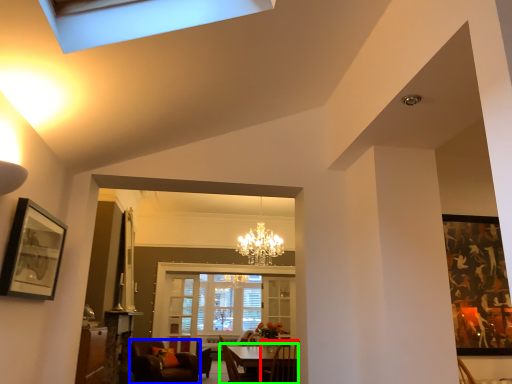
Question: Which object is positioned farthest from chair (highlighted by a red box)? Select from chair (highlighted by a blue box) and table (highlighted by a green box).

Choices:
 (A) chair
 (B) table

Answer: (A)